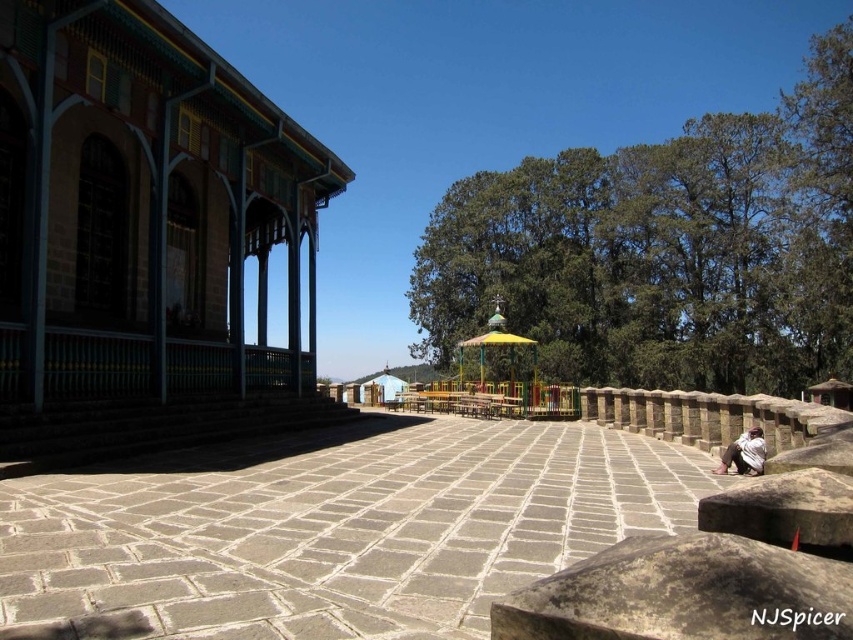
Question: Does green leafy tree at center have a lesser width compared to white cotton shirt at lower right?

Choices:
 (A) no
 (B) yes

Answer: (A)

Question: Among these objects, which one is nearest to the camera?

Choices:
 (A) white cotton shirt at lower right
 (B) green leafy tree at center
 (C) yellow painted wood gazebo at center

Answer: (A)

Question: Which is nearer to the green leafy tree at center?

Choices:
 (A) white cotton shirt at lower right
 (B) yellow painted wood gazebo at center

Answer: (B)

Question: Is green leafy tree at center to the right of white cotton shirt at lower right from the viewer's perspective?

Choices:
 (A) yes
 (B) no

Answer: (A)

Question: Can you confirm if white cotton shirt at lower right is wider than yellow painted wood gazebo at center?

Choices:
 (A) no
 (B) yes

Answer: (A)

Question: Based on their relative distances, which object is farther from the green leafy tree at center?

Choices:
 (A) yellow painted wood gazebo at center
 (B) white cotton shirt at lower right

Answer: (B)